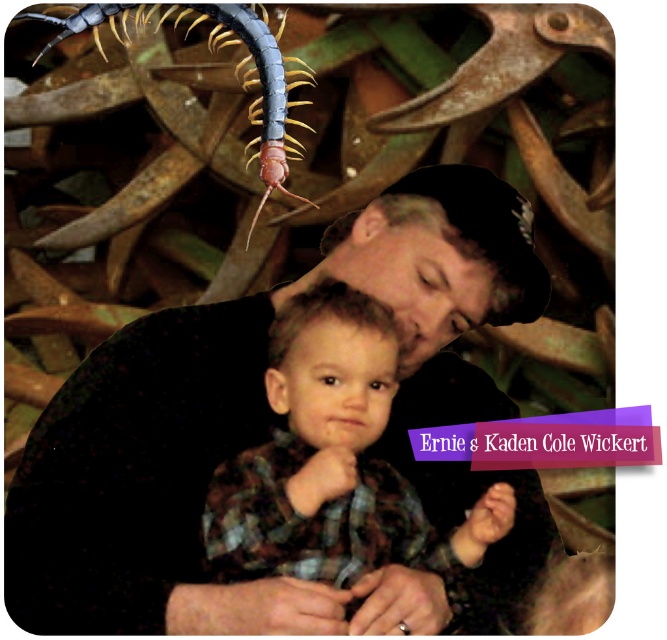
Question: Estimate the real-world distances between objects in this image. Which object is farther from the gray matte centipede at upper left?

Choices:
 (A) plaid fabric shirt at center
 (B) black matte shirt at center

Answer: (A)

Question: Can you confirm if black matte shirt at center is positioned to the right of gray matte centipede at upper left?

Choices:
 (A) yes
 (B) no

Answer: (A)

Question: Estimate the real-world distances between objects in this image. Which object is closer to the gray matte centipede at upper left?

Choices:
 (A) black matte shirt at center
 (B) plaid fabric shirt at center

Answer: (A)

Question: Which object is the farthest from the gray matte centipede at upper left?

Choices:
 (A) black matte shirt at center
 (B) plaid fabric shirt at center

Answer: (B)

Question: Is plaid fabric shirt at center further to camera compared to gray matte centipede at upper left?

Choices:
 (A) yes
 (B) no

Answer: (B)

Question: Does plaid fabric shirt at center come in front of gray matte centipede at upper left?

Choices:
 (A) yes
 (B) no

Answer: (A)